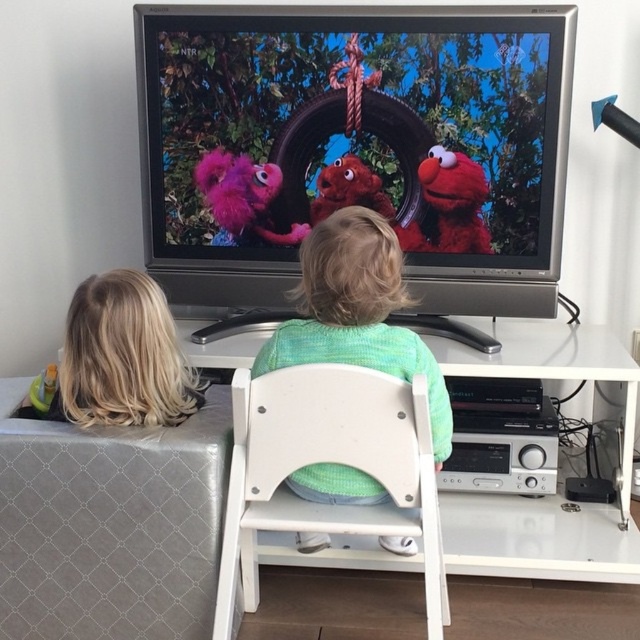
Question: Is white plastic chair at center further to camera compared to green knitted sweater at center?

Choices:
 (A) yes
 (B) no

Answer: (B)

Question: Which is nearer to the red plush toy at center?

Choices:
 (A) green knitted sweater at center
 (B) fuzzy red elmo at upper center

Answer: (B)

Question: Which object is the farthest from the white plastic chair at center?

Choices:
 (A) blonde hair at left
 (B) green knitted sweater at center

Answer: (A)

Question: Is white plastic chair at center to the left of red plush toy at center from the viewer's perspective?

Choices:
 (A) no
 (B) yes

Answer: (B)

Question: Estimate the real-world distances between objects in this image. Which object is farther from the red plush toy at center?

Choices:
 (A) blonde hair at left
 (B) green knitted sweater at center
 (C) fuzzy pink plush at upper left

Answer: (A)

Question: Is white plastic chair at center thinner than fuzzy red elmo at upper center?

Choices:
 (A) no
 (B) yes

Answer: (A)